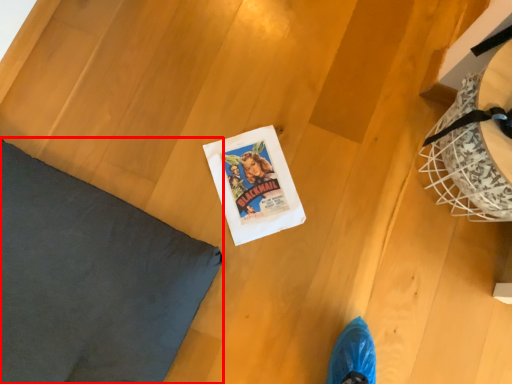
Question: From the image's perspective, where is pillow (annotated by the red box) located relative to comic book?

Choices:
 (A) below
 (B) above

Answer: (A)